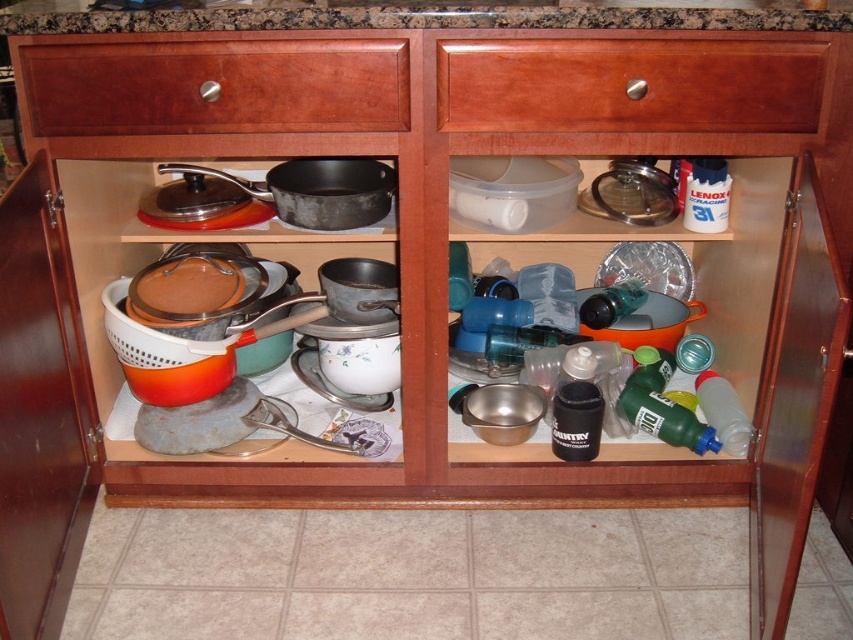
Does wooden drawer at upper left have a larger size compared to white plastic bottle at upper right?

Correct, wooden drawer at upper left is larger in size than white plastic bottle at upper right.

Who is positioned more to the right, wooden drawer at upper left or white plastic bottle at upper right?

Positioned to the right is white plastic bottle at upper right.

Is point (131, 92) closer to camera compared to point (700, 208)?

Yes, point (131, 92) is closer to viewer.

This screenshot has width=853, height=640. In order to click on wooden drawer at upper left in this screenshot , I will do `click(218, 84)`.

Is point (698, 440) positioned behind point (700, 208)?

That is False.

Between green matte bottle at center-right and white plastic bottle at upper right, which one is positioned higher?

white plastic bottle at upper right is above.

Identify the location of green matte bottle at center-right. (665, 419).

Between point (708, 408) and point (630, 301), which one is positioned behind?

The point (630, 301) is more distant.

Does point (724, 390) come farther from viewer compared to point (601, 289)?

No, it is not.

Image resolution: width=853 pixels, height=640 pixels. What are the coordinates of `translucent plastic bottle at right` in the screenshot? It's located at (723, 412).